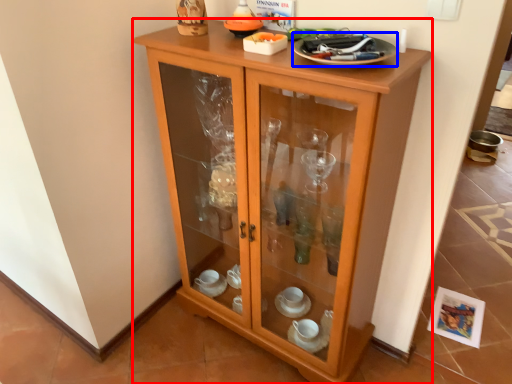
Question: Which object is closer to the camera taking this photo, cupboard (highlighted by a red box) or tableware (highlighted by a blue box)?

Choices:
 (A) cupboard
 (B) tableware

Answer: (A)